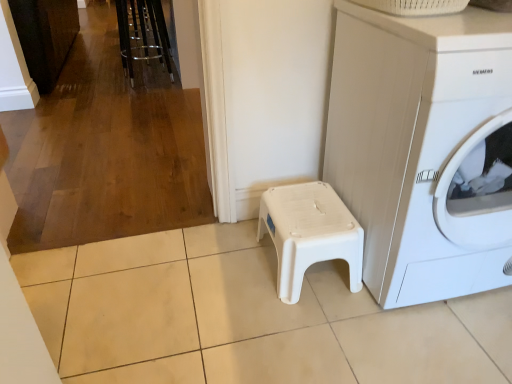
What are the coordinates of `vacant region to the left of white plastic stool at center` in the screenshot? It's located at (226, 273).